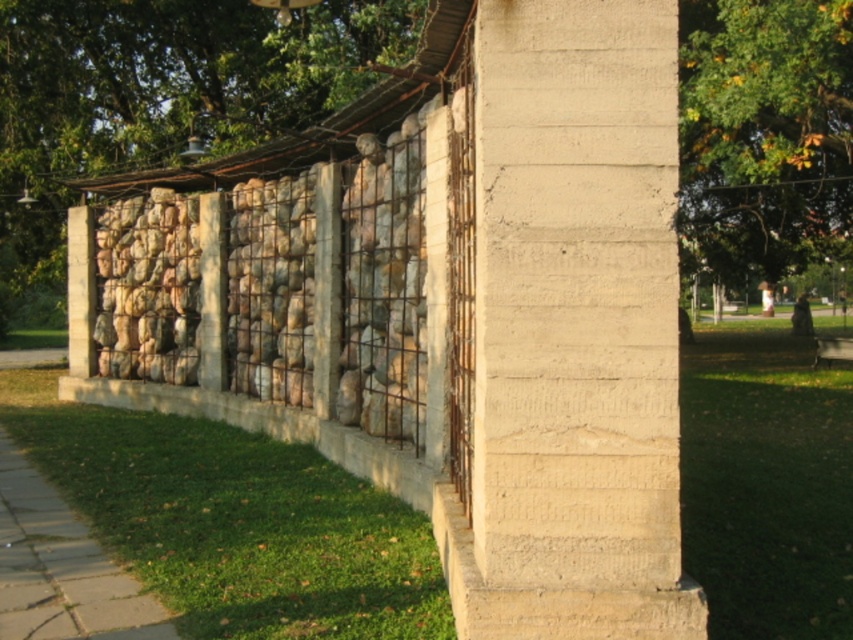
Can you confirm if natural stone wall at center is bigger than green leafy tree at upper right?

Correct, natural stone wall at center is larger in size than green leafy tree at upper right.

Which of these two, natural stone wall at center or green leafy tree at upper right, stands shorter?

Standing shorter between the two is green leafy tree at upper right.

Is point (54, 304) positioned behind point (780, 214)?

Yes.

Where is `natural stone wall at center`? natural stone wall at center is located at coordinates (157, 100).

Does smooth concrete pillar at center come in front of green leafy tree at upper right?

Yes.

Which is behind, point (573, 381) or point (775, 260)?

The point (775, 260) is behind.

Where is `smooth concrete pillar at center`? smooth concrete pillar at center is located at coordinates (573, 330).

Which is behind, point (590, 1) or point (376, 24)?

Positioned behind is point (376, 24).

From the picture: Who is more forward, (596, 132) or (39, 36)?

Point (596, 132)

Where is `smooth concrete pillar at center`? The width and height of the screenshot is (853, 640). smooth concrete pillar at center is located at coordinates click(x=573, y=330).